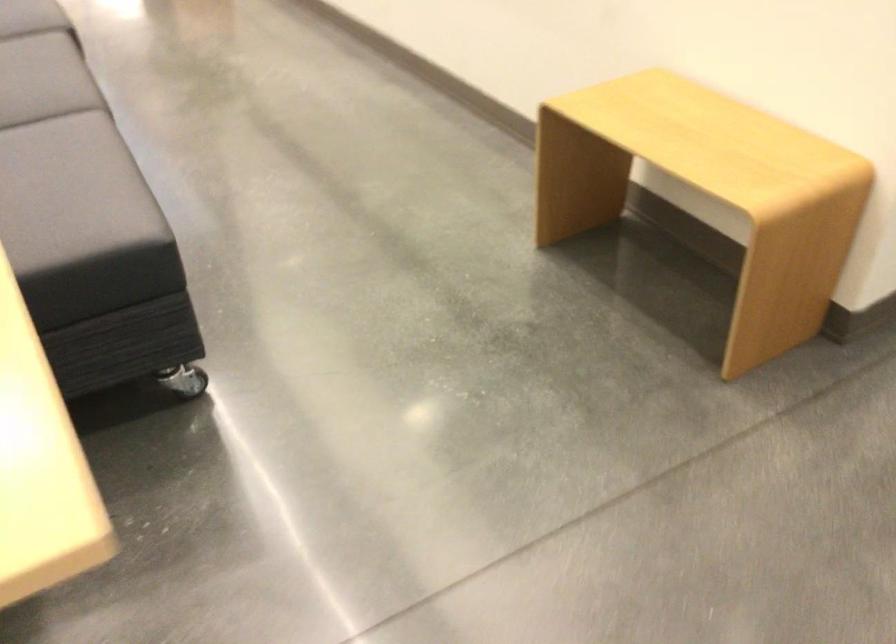
Question: The images are taken continuously from a first-person perspective. In which direction is your viewpoint rotating?

Choices:
 (A) Left
 (B) Right
 (C) Up
 (D) Down

Answer: (A)